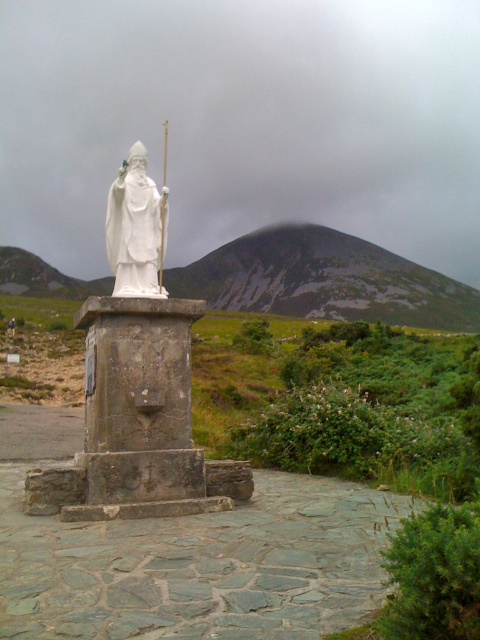
You are an art conservator assessing the statues in the scene. The white porcelain statue at center and the white stone statue at center are both in need of restoration. Based on their materials, which one might require more frequent maintenance due to its material properties?

The white porcelain statue at center might require more frequent maintenance because porcelain is generally more fragile and prone to cracking or chipping compared to stone, which is more durable and resistant to environmental wear over time.

You are an art conservator assessing the statue in the scene. You notice that the white porcelain statue at center and the white stone statue at center are both in need of restoration. Based on their heights, which one might require a taller ladder for reaching its highest point?

The white porcelain statue at center has a greater height compared to the white stone statue at center, so the white porcelain statue at center would require a taller ladder to reach its highest point.

You are a visitor at the statue area and want to take a photo of the white porcelain statue at center and the white stone statue at center. Which one is placed higher than the other?

The white porcelain statue at center is positioned over white stone statue at center, so it is placed higher.